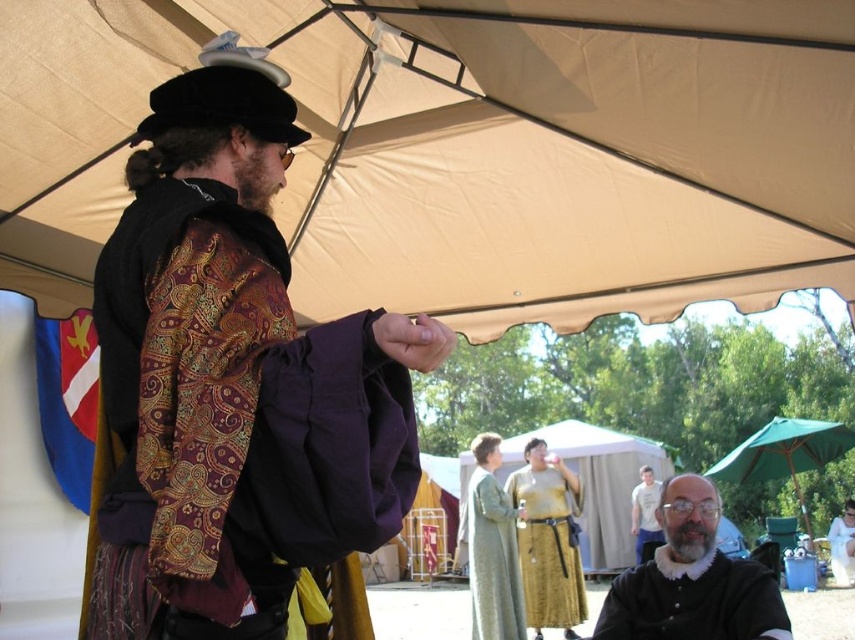
Question: Can you confirm if matte black shirt at center is bigger than golden fabric tent at center?

Choices:
 (A) no
 (B) yes

Answer: (A)

Question: Based on their relative distances, which object is nearer to the matte black shirt at center?

Choices:
 (A) green fabric umbrella at lower right
 (B) white satin dress at lower right

Answer: (A)

Question: Among these objects, which one is nearest to the camera?

Choices:
 (A) golden fabric tent at center
 (B) matte black shirt at center

Answer: (B)

Question: Does beige canvas canopy at upper center appear under golden fabric tent at center?

Choices:
 (A) no
 (B) yes

Answer: (A)

Question: Is matte black hat at upper left thinner than green fabric umbrella at lower right?

Choices:
 (A) yes
 (B) no

Answer: (A)

Question: Which of the following is the farthest from the observer?

Choices:
 (A) smooth gray robe at center
 (B) light gray cotton shirt at center
 (C) white satin dress at lower right

Answer: (C)